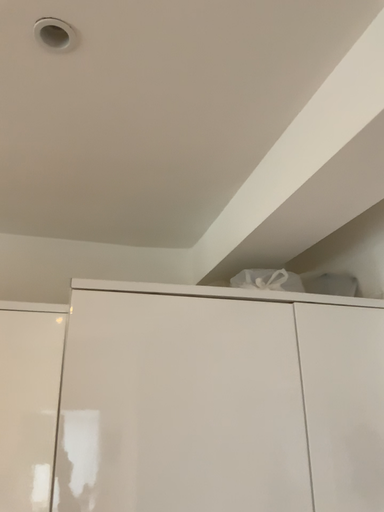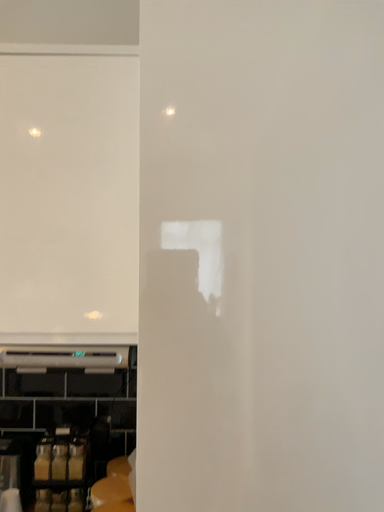
Question: How did the camera likely rotate when shooting the video?

Choices:
 (A) rotated right
 (B) rotated left

Answer: (B)